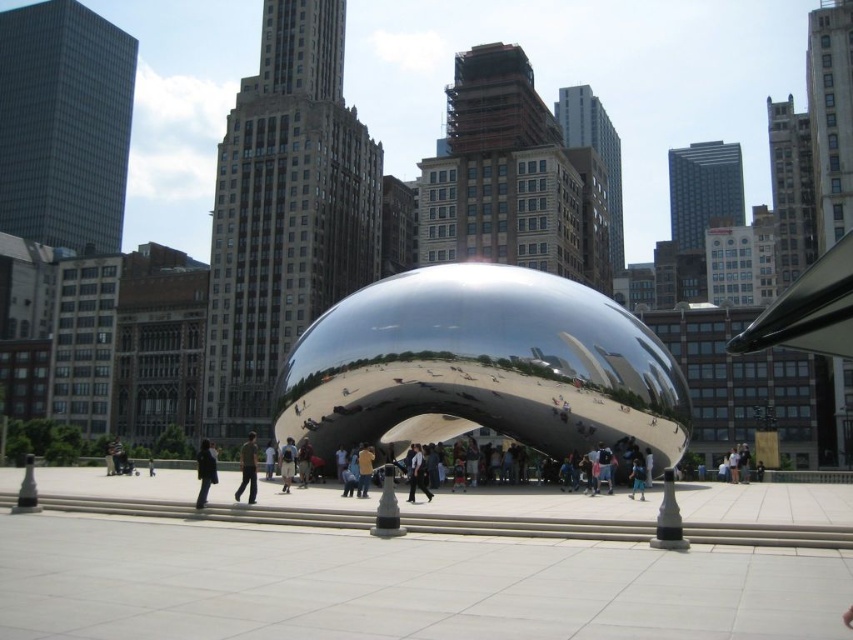
Between green fabric shirt at center and light blue shirt at center, which one appears on the left side from the viewer's perspective?

From the viewer's perspective, green fabric shirt at center appears more on the left side.

This screenshot has height=640, width=853. What are the coordinates of `green fabric shirt at center` in the screenshot? It's located at (247, 468).

Where is `green fabric shirt at center`? The width and height of the screenshot is (853, 640). green fabric shirt at center is located at coordinates (247, 468).

Is dark gray jacket at center further to camera compared to light brown fabric pants at center?

No, dark gray jacket at center is in front of light brown fabric pants at center.

Find the location of a particular element. dark gray jacket at center is located at coordinates (206, 472).

Locate an element on the screen. dark gray jacket at center is located at coordinates (206, 472).

Describe the element at coordinates (364, 468) in the screenshot. Image resolution: width=853 pixels, height=640 pixels. I see `brown leather jacket at center` at that location.

Between brown leather jacket at center and light brown fabric pants at center, which one has less height?

light brown fabric pants at center is shorter.

What do you see at coordinates (364, 468) in the screenshot? I see `brown leather jacket at center` at bounding box center [364, 468].

Identify the location of brown leather jacket at center. (364, 468).